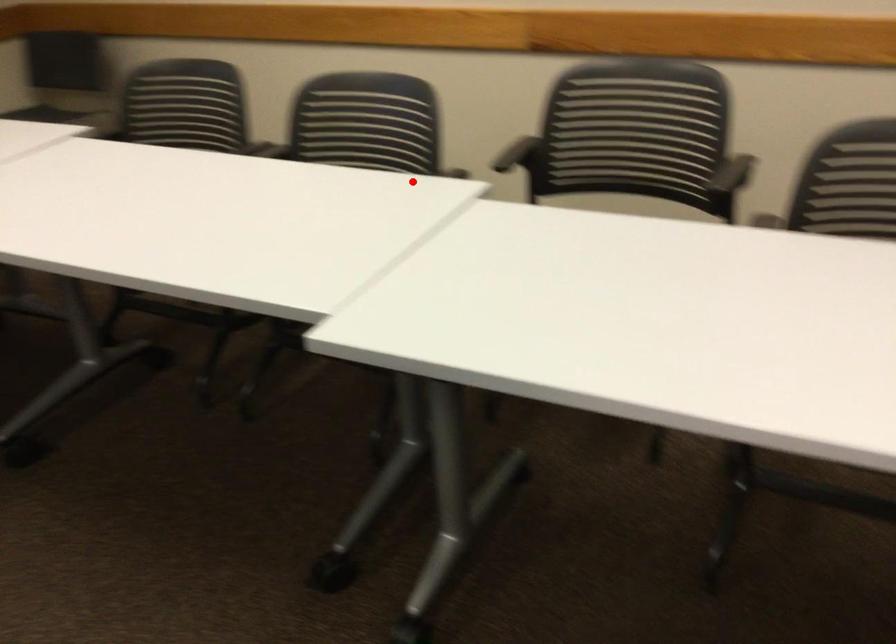
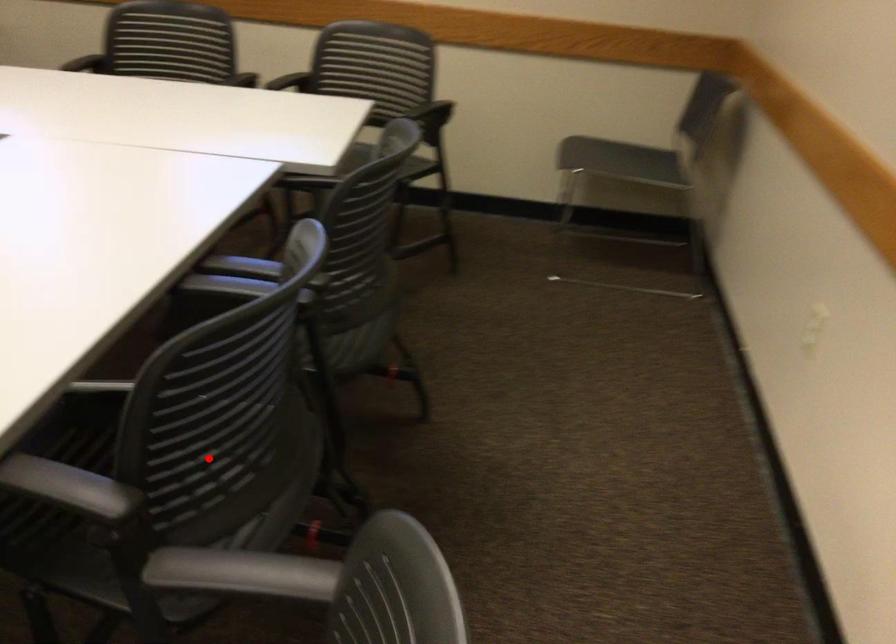
I am providing you with two images of the same scene from different viewpoints. A red point is marked on the first image and another point is marked on the second image. Does the point marked in image1 correspond to the same location as the one in image2?

Yes